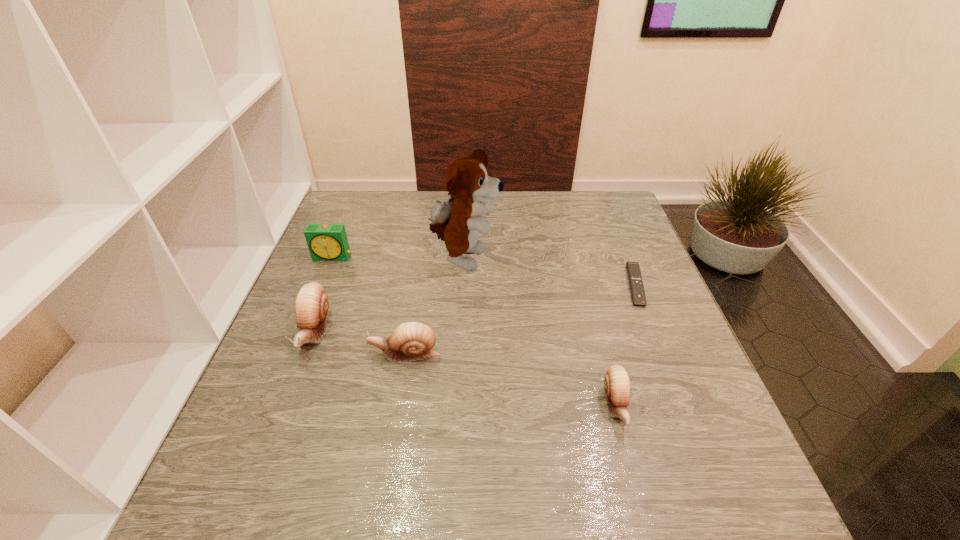
Where is `vacant space at the near edge of the desktop`? vacant space at the near edge of the desktop is located at coordinates (464, 444).

Locate an element on the screen. This screenshot has height=540, width=960. free space at the left edge of the desktop is located at coordinates (333, 279).

At what (x,y) coordinates should I click in order to perform the action: click on vacant space at the right edge of the desktop. Please return your answer as a coordinate pair (x, y). The image size is (960, 540). Looking at the image, I should click on (599, 253).

In the image, there is a desktop. Identify the location of free space at the far left corner. (369, 195).

Where is `vacant space at the near left corner`? The height and width of the screenshot is (540, 960). vacant space at the near left corner is located at coordinates (x=260, y=417).

The height and width of the screenshot is (540, 960). Find the location of `free spot at the far right corner of the desktop`. free spot at the far right corner of the desktop is located at coordinates (590, 198).

This screenshot has height=540, width=960. In order to click on vacant space that is in between the shortest object and the puppy in this screenshot , I will do `click(550, 273)`.

Image resolution: width=960 pixels, height=540 pixels. Find the location of `free space between the leftmost escargot and the remote control`. free space between the leftmost escargot and the remote control is located at coordinates (475, 309).

The width and height of the screenshot is (960, 540). Identify the location of vacant region between the leftmost escargot and the shortest escargot. (465, 369).

In order to click on free space that is in between the tallest object and the shortest object in this screenshot , I will do `click(550, 273)`.